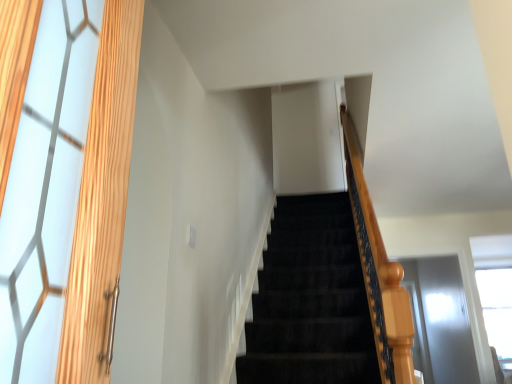
I want to click on wooden frame at left, so click(x=63, y=181).

In order to face wooden frame at left, should I rotate leftwards or rightwards?

You should rotate left by 22.934 degrees.

In the scene shown: Measure the distance between point (116, 51) and camera.

The distance of point (116, 51) from camera is 82.60 centimeters.

This screenshot has width=512, height=384. Describe the element at coordinates (63, 181) in the screenshot. I see `wooden frame at left` at that location.

I want to click on wooden frame at left, so click(x=63, y=181).